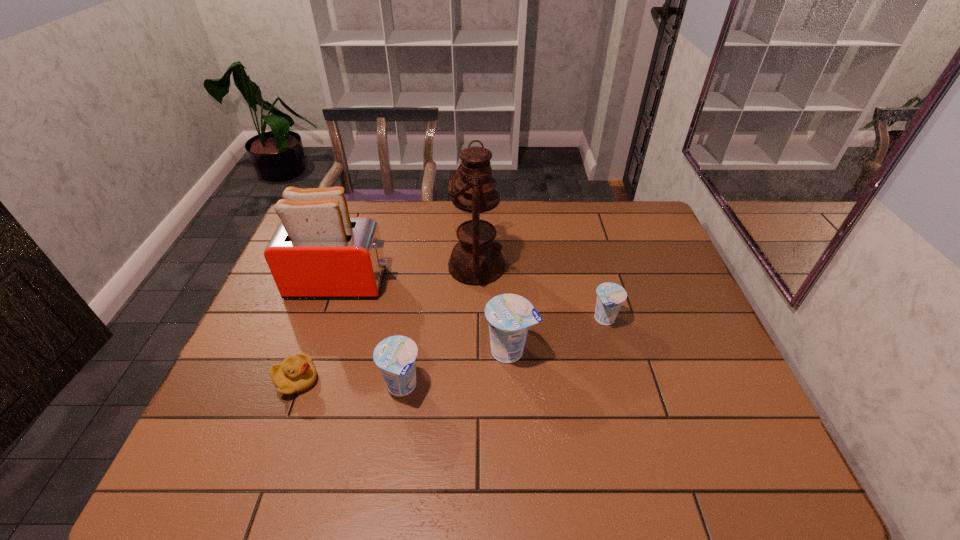
Identify the location of the third object from left to right. The width and height of the screenshot is (960, 540). (396, 356).

Where is `the second shortest yogurt`? The height and width of the screenshot is (540, 960). the second shortest yogurt is located at coordinates (396, 356).

The image size is (960, 540). What are the coordinates of `the third tallest object` in the screenshot? It's located at (509, 316).

The width and height of the screenshot is (960, 540). Identify the location of the second yogurt from right to left. (509, 316).

The image size is (960, 540). Identify the location of the rightmost yogurt. tap(610, 296).

The height and width of the screenshot is (540, 960). I want to click on the shortest yogurt, so (x=610, y=296).

Where is `the second tallest object`? Image resolution: width=960 pixels, height=540 pixels. the second tallest object is located at coordinates (318, 251).

Find the location of a particular element. The height and width of the screenshot is (540, 960). the tallest object is located at coordinates (476, 259).

I want to click on the shortest object, so click(x=295, y=374).

The image size is (960, 540). In order to click on vacant space located 0.350m on the right of the third shortest object in this screenshot , I will do `click(566, 387)`.